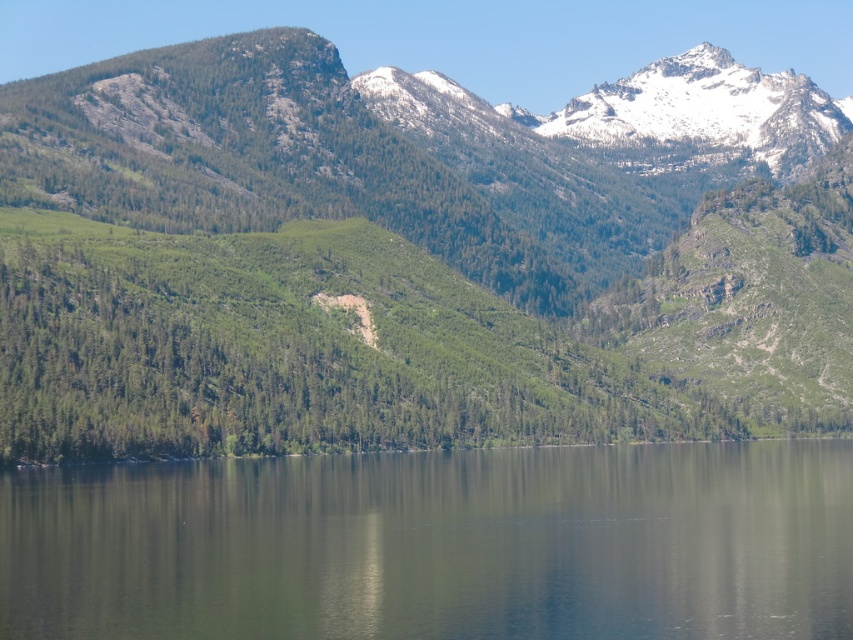
Question: Which point is closer to the camera?

Choices:
 (A) (469, 568)
 (B) (9, 310)

Answer: (A)

Question: Which object appears closest to the camera in this image?

Choices:
 (A) green reflective water at center
 (B) green forested mountain at center

Answer: (A)

Question: From the image, what is the correct spatial relationship of green forested mountain at center in relation to green reflective water at center?

Choices:
 (A) right
 (B) left

Answer: (A)

Question: Can you confirm if green forested mountain at center is positioned below green reflective water at center?

Choices:
 (A) yes
 (B) no

Answer: (B)

Question: Which of the following is the closest to the observer?

Choices:
 (A) green reflective water at center
 (B) green forested mountain at center

Answer: (A)

Question: Does green forested mountain at center have a larger size compared to green reflective water at center?

Choices:
 (A) yes
 (B) no

Answer: (A)